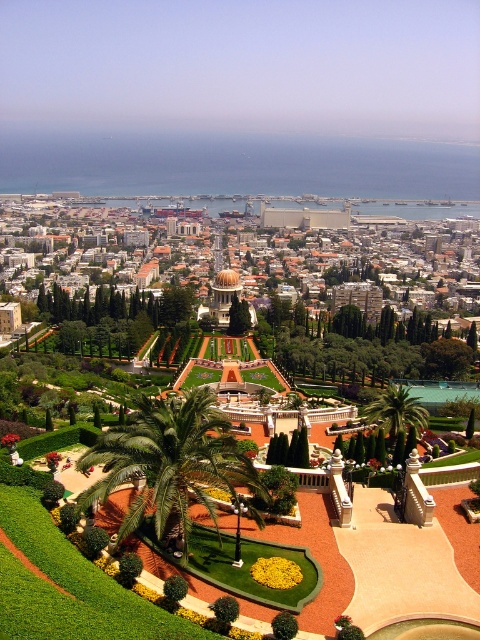
Question: Among these objects, which one is farthest from the camera?

Choices:
 (A) green leafy palm at center
 (B) green leafy palm tree at center
 (C) matte gold dome at center

Answer: (C)

Question: Which point is farther from the camera taking this photo?

Choices:
 (A) (441, 324)
 (B) (259, 524)

Answer: (A)

Question: Which point is closer to the camera?

Choices:
 (A) (322, 237)
 (B) (372, 404)

Answer: (B)

Question: Is matte gold dome at center to the left of green leafy palm tree at center from the viewer's perspective?

Choices:
 (A) yes
 (B) no

Answer: (A)

Question: Can you confirm if green leafy palm at center is positioned to the right of green leafy palm tree at center?

Choices:
 (A) yes
 (B) no

Answer: (B)

Question: Does matte gold dome at center have a smaller size compared to green leafy palm tree at center?

Choices:
 (A) yes
 (B) no

Answer: (B)